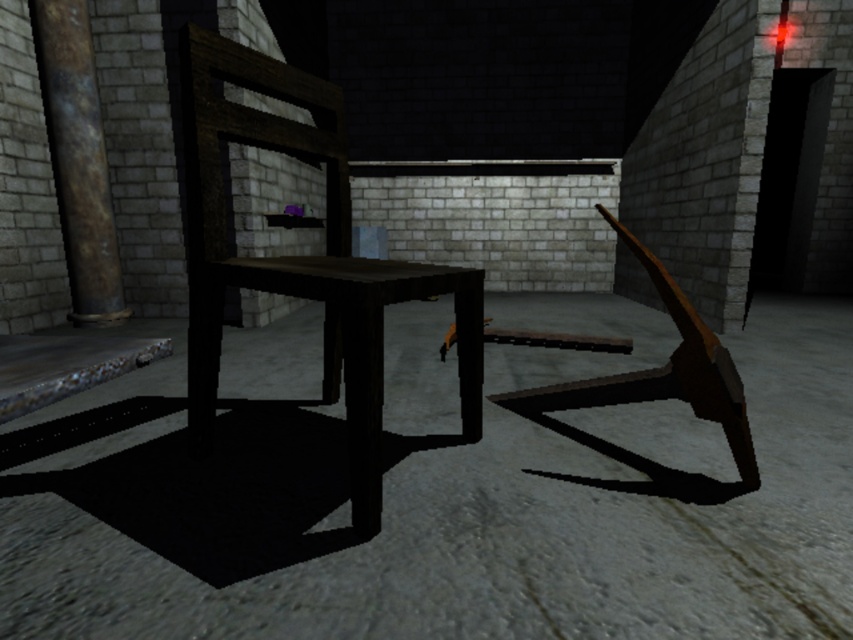
Question: Which of the following is the farthest from the observer?

Choices:
 (A) rusty metal pillar at left
 (B) wooden chair at center

Answer: (A)

Question: Which point is farther from the camera taking this photo?

Choices:
 (A) (190, 198)
 (B) (103, 225)

Answer: (B)

Question: Does wooden chair at center appear on the left side of rusty metal pillar at left?

Choices:
 (A) no
 (B) yes

Answer: (A)

Question: Does wooden chair at center appear on the left side of rusty metal pillar at left?

Choices:
 (A) no
 (B) yes

Answer: (A)

Question: Is the position of wooden chair at center more distant than that of rusty metal pillar at left?

Choices:
 (A) no
 (B) yes

Answer: (A)